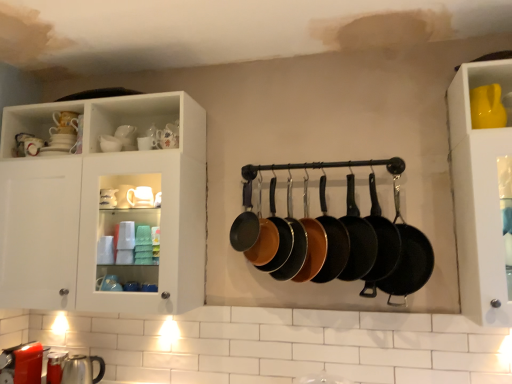
Measure the distance between point [126,297] and camera.

They are 6.12 feet apart.

This screenshot has width=512, height=384. Describe the element at coordinates (103, 208) in the screenshot. I see `white glossy cabinet at upper left` at that location.

Image resolution: width=512 pixels, height=384 pixels. What do you see at coordinates (294, 243) in the screenshot?
I see `matte black frying pan at center, the 6th frying pan viewed from the right` at bounding box center [294, 243].

How much space does matte black frying pan at center, which is the fourth frying pan in left-to-right order, occupy horizontally?

matte black frying pan at center, which is the fourth frying pan in left-to-right order, is 3.49 inches wide.

What do you see at coordinates (167, 137) in the screenshot? I see `matte ceramic cups at upper center, which appears as the second tableware when viewed from the right` at bounding box center [167, 137].

Locate an element on the screen. matte black frying pan at center, positioned as the seventh frying pan in left-to-right order is located at coordinates (358, 238).

Where is `matte black frying pan at center, which is the third frying pan in left-to-right order`? The width and height of the screenshot is (512, 384). matte black frying pan at center, which is the third frying pan in left-to-right order is located at coordinates (279, 235).

Is yellow matte cup at upper right, marked as the fourth tableware in a left-to-right arrangement, next to metallic silver kettle at lower left, which is the 1th tableware from bottom to top?

No, yellow matte cup at upper right, marked as the fourth tableware in a left-to-right arrangement, is not making contact with metallic silver kettle at lower left, which is the 1th tableware from bottom to top.

Is yellow matte cup at upper right, marked as the fourth tableware in a left-to-right arrangement, completely or partially outside of metallic silver kettle at lower left, which is the 1th tableware from bottom to top?

Indeed, yellow matte cup at upper right, marked as the fourth tableware in a left-to-right arrangement, is completely outside metallic silver kettle at lower left, which is the 1th tableware from bottom to top.

From the image's perspective, is matte black frying pan at center, positioned as the seventh frying pan in left-to-right order, positioned above or below matte black frying pan at center, which is the fourth frying pan in left-to-right order?

matte black frying pan at center, positioned as the seventh frying pan in left-to-right order, is above matte black frying pan at center, which is the fourth frying pan in left-to-right order.

Measure the distance between matte black frying pan at center, positioned as the seventh frying pan in left-to-right order, and matte black frying pan at center, which is the fourth frying pan in left-to-right order.

The distance of matte black frying pan at center, positioned as the seventh frying pan in left-to-right order, from matte black frying pan at center, which is the fourth frying pan in left-to-right order, is 9.32 inches.

How many degrees apart are the facing directions of matte black frying pan at center, which is the third frying pan in right-to-left order, and matte black frying pan at center, which is the fourth frying pan in left-to-right order?

matte black frying pan at center, which is the third frying pan in right-to-left order, and matte black frying pan at center, which is the fourth frying pan in left-to-right order, are facing 3.41 degrees away from each other.

Are matte black frying pan at center, which is the third frying pan in right-to-left order, and matte black frying pan at center, which is the fourth frying pan in left-to-right order, beside each other?

No, matte black frying pan at center, which is the third frying pan in right-to-left order, is not next to matte black frying pan at center, which is the fourth frying pan in left-to-right order.

Can you tell me how much black non-stick frying pan at center, which appears as the second frying pan when viewed from the right, and matte ceramic cups at upper center, placed as the 2th tableware when sorted from top to bottom, differ in facing direction?

A: 28.6 degrees separate the facing orientations of black non-stick frying pan at center, which appears as the second frying pan when viewed from the right, and matte ceramic cups at upper center, placed as the 2th tableware when sorted from top to bottom.

You are a GUI agent. You are given a task and a screenshot of the screen. Output one action in this format:
    pyautogui.click(x=<x>, y=<y>)
    Task: Click on the 8th frying pan below the matte ceramic cups at upper center, the 3th tableware in the bottom-to-top sequence (from the image's perspective)
    This screenshot has width=512, height=384.
    Given the screenshot: What is the action you would take?
    pyautogui.click(x=381, y=244)

Considering the sizes of objects black non-stick frying pan at center, which appears as the second frying pan when viewed from the right, and matte ceramic cups at upper center, which appears as the second tableware when viewed from the right, in the image provided, who is thinner, black non-stick frying pan at center, which appears as the second frying pan when viewed from the right, or matte ceramic cups at upper center, which appears as the second tableware when viewed from the right,?

matte ceramic cups at upper center, which appears as the second tableware when viewed from the right.

From a real-world perspective, which is physically above, black non-stick frying pan at center, which appears as the second frying pan when viewed from the right, or matte ceramic cups at upper center, placed as the 2th tableware when sorted from top to bottom?

From a 3D spatial view, matte ceramic cups at upper center, placed as the 2th tableware when sorted from top to bottom, is above.

Is black cast iron frying pan at center, placed as the ninth frying pan when sorted from left to right, surrounding matte ceramic cups at upper center, arranged as the 3th tableware when viewed from the left?

That's incorrect, matte ceramic cups at upper center, arranged as the 3th tableware when viewed from the left, is not inside black cast iron frying pan at center, placed as the ninth frying pan when sorted from left to right.

Is black cast iron frying pan at center, placed as the ninth frying pan when sorted from left to right, bigger than matte ceramic cups at upper center, the 3th tableware in the bottom-to-top sequence?

Indeed, black cast iron frying pan at center, placed as the ninth frying pan when sorted from left to right, has a larger size compared to matte ceramic cups at upper center, the 3th tableware in the bottom-to-top sequence.

Can you confirm if black cast iron frying pan at center, which is the 1th frying pan in right-to-left order, is thinner than matte ceramic cups at upper center, the 3th tableware in the front-to-back sequence?

In fact, black cast iron frying pan at center, which is the 1th frying pan in right-to-left order, might be wider than matte ceramic cups at upper center, the 3th tableware in the front-to-back sequence.

Which point is more forward, (396, 175) or (291, 201)?

Point (396, 175)

Which is more to the left, black cast iron frying pan at center, placed as the ninth frying pan when sorted from left to right, or matte black frying pan at center, the 6th frying pan viewed from the right?

matte black frying pan at center, the 6th frying pan viewed from the right.

Considering the sizes of black cast iron frying pan at center, placed as the ninth frying pan when sorted from left to right, and matte black frying pan at center, the 6th frying pan viewed from the right, in the image, is black cast iron frying pan at center, placed as the ninth frying pan when sorted from left to right, wider or thinner than matte black frying pan at center, the 6th frying pan viewed from the right,?

black cast iron frying pan at center, placed as the ninth frying pan when sorted from left to right, is wider than matte black frying pan at center, the 6th frying pan viewed from the right.

Between matte ceramic cups at upper center, the 3th tableware in the bottom-to-top sequence, and matte brown frying pan at center, the eighth frying pan from the right, which one appears on the right side from the viewer's perspective?

From the viewer's perspective, matte brown frying pan at center, the eighth frying pan from the right, appears more on the right side.

How many degrees apart are the facing directions of matte ceramic cups at upper center, arranged as the 3th tableware when viewed from the left, and matte brown frying pan at center, the eighth frying pan from the right?

The facing directions of matte ceramic cups at upper center, arranged as the 3th tableware when viewed from the left, and matte brown frying pan at center, the eighth frying pan from the right, are 28.6 degrees apart.

Which of these two, matte ceramic cups at upper center, arranged as the 3th tableware when viewed from the left, or matte brown frying pan at center, which is the second frying pan from left to right, is thinner?

matte ceramic cups at upper center, arranged as the 3th tableware when viewed from the left.

Where is `the 2nd frying pan positioned below the matte ceramic cups at upper center, arranged as the 3th tableware when viewed from the left (from the image's perspective)`? the 2nd frying pan positioned below the matte ceramic cups at upper center, arranged as the 3th tableware when viewed from the left (from the image's perspective) is located at coordinates (264, 241).

Is the surface of matte black frying pan at center, positioned as the seventh frying pan in left-to-right order, in direct contact with matte brown frying pan at center, which is the second frying pan from left to right?

No, matte black frying pan at center, positioned as the seventh frying pan in left-to-right order, is not beside matte brown frying pan at center, which is the second frying pan from left to right.

Does matte black frying pan at center, positioned as the seventh frying pan in left-to-right order, have a lesser height compared to matte brown frying pan at center, which is the second frying pan from left to right?

Incorrect, the height of matte black frying pan at center, positioned as the seventh frying pan in left-to-right order, does not fall short of that of matte brown frying pan at center, which is the second frying pan from left to right.

From the image's perspective, count 1st frying pans downward from the matte brown frying pan at center, the eighth frying pan from the right, and point to it. Please provide its 2D coordinates.

[(358, 238)]

Between matte black frying pan at center, positioned as the seventh frying pan in left-to-right order, and matte brown frying pan at center, which is the second frying pan from left to right, which one is positioned in front?

matte black frying pan at center, positioned as the seventh frying pan in left-to-right order, is in front.

This screenshot has height=384, width=512. I want to click on the 3rd tableware positioned above the metallic silver kettle at lower left, which ranks as the fourth tableware in top-to-bottom order (from a real-world perspective), so [487, 107].

The width and height of the screenshot is (512, 384). Find the location of `frying pan that is the 3rd one when counting leftward from the matte black frying pan at center, which is the third frying pan in right-to-left order`. frying pan that is the 3rd one when counting leftward from the matte black frying pan at center, which is the third frying pan in right-to-left order is located at coordinates (294, 243).

Based on their spatial positions, is black non-stick frying pan at center, which appears as the second frying pan when viewed from the right, or matte black frying pan at center, which is the fourth frying pan in left-to-right order, further from white glossy cup at upper center, the 3th tableware positioned from the top?

The object further to white glossy cup at upper center, the 3th tableware positioned from the top, is black non-stick frying pan at center, which appears as the second frying pan when viewed from the right.

When comparing their distances from black cast iron frying pan at center, placed as the ninth frying pan when sorted from left to right, does matte black frying pan at center, which is the fourth frying pan in left-to-right order, or matte black frying pan at center, which is the third frying pan in right-to-left order, seem further?

The object further to black cast iron frying pan at center, placed as the ninth frying pan when sorted from left to right, is matte black frying pan at center, which is the fourth frying pan in left-to-right order.

Looking at the image, which one is located closer to matte black frying pan at center, acting as the 6th frying pan starting from the left, white glossy cabinet at upper left or matte brown frying pan at center, the eighth frying pan from the right?

The object closer to matte black frying pan at center, acting as the 6th frying pan starting from the left, is matte brown frying pan at center, the eighth frying pan from the right.

From the picture: Looking at the image, which one is located further to black cast iron frying pan at center, which is the 1th frying pan in right-to-left order, matte black frying pan at center, positioned as the seventh frying pan in left-to-right order, or matte brown frying pan at center, the eighth frying pan from the right?

The object further to black cast iron frying pan at center, which is the 1th frying pan in right-to-left order, is matte brown frying pan at center, the eighth frying pan from the right.

From the image, which object appears to be farther from matte black frying pan at center, acting as the 6th frying pan starting from the left, black cast iron frying pan at center, which is the 1th frying pan in right-to-left order, or matte black frying pan at center, which is the fourth frying pan in left-to-right order?

Based on the image, black cast iron frying pan at center, which is the 1th frying pan in right-to-left order, appears to be further to matte black frying pan at center, acting as the 6th frying pan starting from the left.

Which object lies further to the anchor point matte brown frying pan at center, the eighth frying pan from the right, matte ceramic cups at upper center, marked as the 2th tableware in a back-to-front arrangement, or black non-stick frying pan at center, acting as the eighth frying pan starting from the left?

matte ceramic cups at upper center, marked as the 2th tableware in a back-to-front arrangement, is further to matte brown frying pan at center, the eighth frying pan from the right.

Looking at the image, which one is located further to matte black frying pan at center, which is the third frying pan in left-to-right order, metallic silver kettle at lower left, the fourth tableware when ordered from right to left, or matte black frying pan at center, marked as the fifth frying pan in a right-to-left arrangement?

metallic silver kettle at lower left, the fourth tableware when ordered from right to left.

When comparing their distances from white glossy cabinet at upper left, does matte black frying pan at center, marked as the fifth frying pan in a right-to-left arrangement, or black cast iron frying pan at center, which is the 1th frying pan in right-to-left order, seem further?

Among the two, black cast iron frying pan at center, which is the 1th frying pan in right-to-left order, is located further to white glossy cabinet at upper left.

At what (x,y) coordinates should I click in order to perform the action: click on frying pan between matte brown frying pan at center, the eighth frying pan from the right, and matte black frying pan at center, the 6th frying pan viewed from the right. Please return your answer as a coordinate pair (x, y). Image resolution: width=512 pixels, height=384 pixels. Looking at the image, I should click on (279, 235).

The height and width of the screenshot is (384, 512). I want to click on tableware between white glossy cup at upper center, which is the second tableware from left to right, and shiny black frying pan at center, marked as the 9th frying pan in a right-to-left arrangement, in the horizontal direction, so click(x=167, y=137).

This screenshot has height=384, width=512. I want to click on frying pan situated between matte black frying pan at center, which is the fourth frying pan in left-to-right order, and matte black frying pan at center, acting as the 6th frying pan starting from the left, from left to right, so click(x=312, y=242).

At what (x,y) coordinates should I click in order to perform the action: click on tableware between white glossy cup at upper center, acting as the second tableware starting from the bottom, and matte black frying pan at center, the seventh frying pan viewed from the right, in the horizontal direction. Please return your answer as a coordinate pair (x, y). Image resolution: width=512 pixels, height=384 pixels. Looking at the image, I should click on click(167, 137).